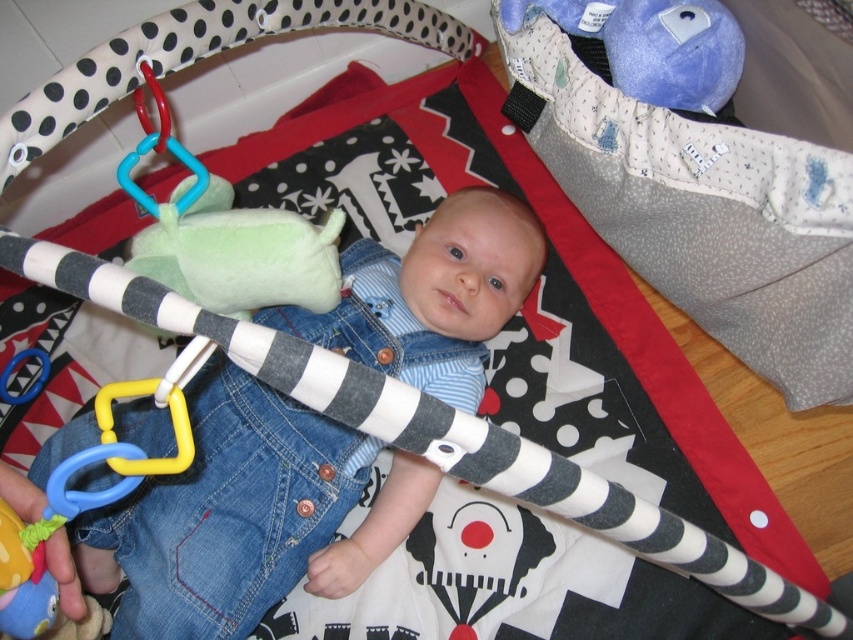
You are a parent trying to ensure the baby doesn not grab the green plush toy at center while lying on the denim overalls at center. Can you tell me if the baby is positioned below the toy?

The denim overalls at center is positioned under the green plush toy at center, so yes, the baby lying on the denim overalls at center is positioned below the green plush toy at center.

You are a parent trying to distract your baby. You see the denim overalls at center and the green plush toy at center. Which object is positioned to the right side?

The denim overalls at center is to the right of the green plush toy at center, so the denim overalls at center is positioned to the right side.